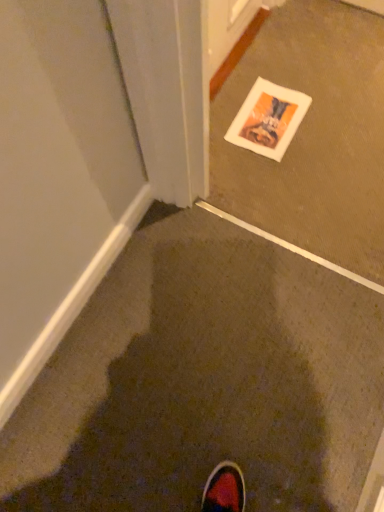
Question: Is brown matte carpet at center surrounded by white paper at center?

Choices:
 (A) no
 (B) yes

Answer: (A)

Question: Is white paper at center outside of brown matte carpet at center?

Choices:
 (A) no
 (B) yes

Answer: (B)

Question: Is white paper at center smaller than brown matte carpet at center?

Choices:
 (A) yes
 (B) no

Answer: (B)

Question: From the image's perspective, would you say white paper at center is shown under brown matte carpet at center?

Choices:
 (A) yes
 (B) no

Answer: (B)

Question: From the image's perspective, would you say white paper at center is positioned over brown matte carpet at center?

Choices:
 (A) no
 (B) yes

Answer: (B)

Question: Considering the relative positions of white paper at center and brown matte carpet at center in the image provided, is white paper at center to the right of brown matte carpet at center from the viewer's perspective?

Choices:
 (A) yes
 (B) no

Answer: (A)

Question: From a real-world perspective, is brown matte carpet at center under white paper at center?

Choices:
 (A) no
 (B) yes

Answer: (B)

Question: From the image's perspective, would you say brown matte carpet at center is shown under white paper at center?

Choices:
 (A) yes
 (B) no

Answer: (A)

Question: Is brown matte carpet at center wider than white paper at center?

Choices:
 (A) yes
 (B) no

Answer: (B)

Question: Is brown matte carpet at center shorter than white paper at center?

Choices:
 (A) yes
 (B) no

Answer: (A)

Question: Is white paper at center surrounded by brown matte carpet at center?

Choices:
 (A) no
 (B) yes

Answer: (A)

Question: Can you confirm if brown matte carpet at center is positioned to the left of white paper at center?

Choices:
 (A) yes
 (B) no

Answer: (A)

Question: In terms of width, does white paper at center look wider or thinner when compared to brown matte carpet at center?

Choices:
 (A) wide
 (B) thin

Answer: (A)